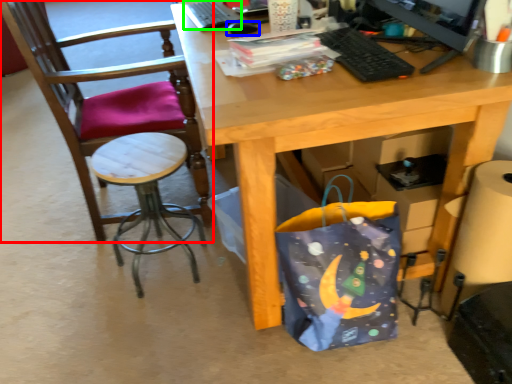
Question: Considering the real-world distances, which object is closest to chair (highlighted by a red box)? mouse (highlighted by a blue box) or laptop keyboard (highlighted by a green box).

Choices:
 (A) mouse
 (B) laptop keyboard

Answer: (B)